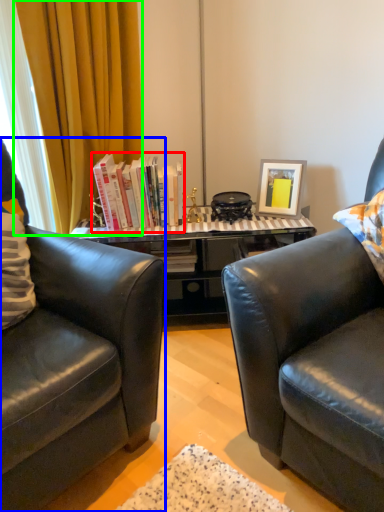
Question: Which is farther away from book (highlighted by a red box)? chair (highlighted by a blue box) or curtain (highlighted by a green box)?

Choices:
 (A) chair
 (B) curtain

Answer: (A)